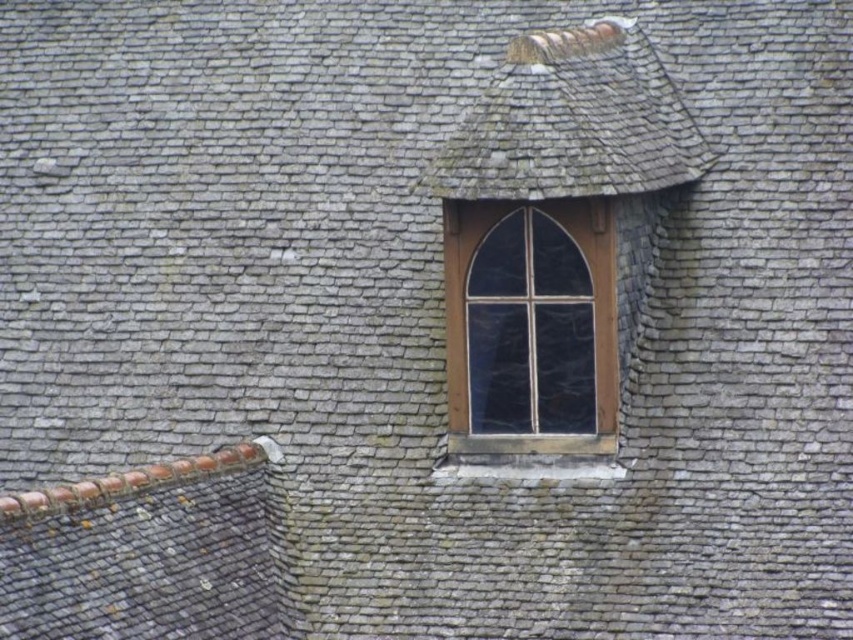
Is point (508, 273) positioned behind point (624, 38)?

No, (508, 273) is closer to viewer.

Based on the photo, which is more to the right, clear glass window at center or gray shingles at upper center?

Positioned to the right is gray shingles at upper center.

The width and height of the screenshot is (853, 640). What are the coordinates of `clear glass window at center` in the screenshot? It's located at (531, 326).

Locate an element on the screen. clear glass window at center is located at coordinates pyautogui.click(x=531, y=326).